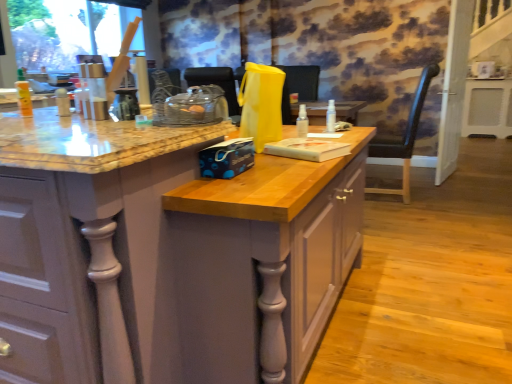
Where is `free space in front of black leather chair at right`? free space in front of black leather chair at right is located at coordinates (404, 212).